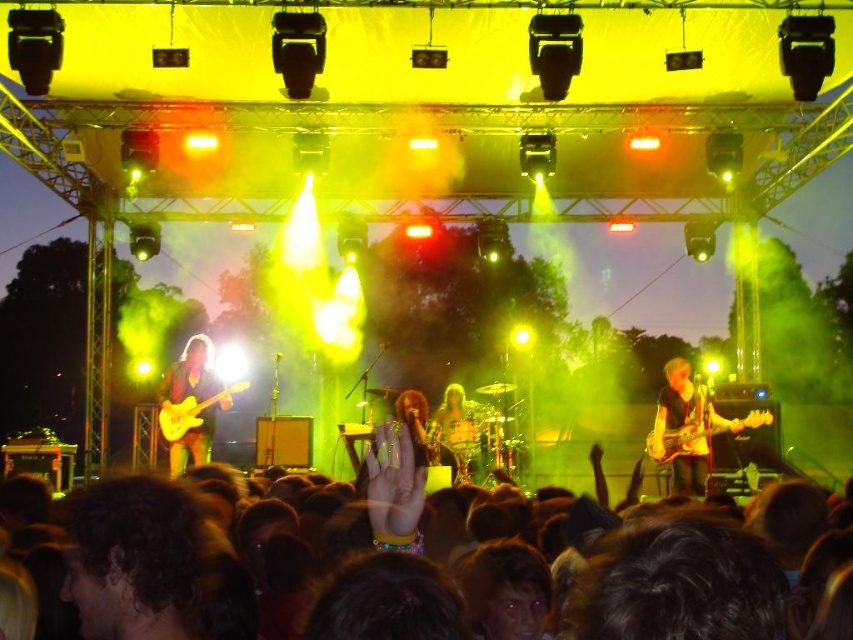
Question: Can you confirm if dark brown hair at lower center is wider than shiny gold guitar at left?

Choices:
 (A) no
 (B) yes

Answer: (A)

Question: Does matte black guitar at right appear under shiny gold guitar at left?

Choices:
 (A) no
 (B) yes

Answer: (B)

Question: Estimate the real-world distances between objects in this image. Which object is farther from the yellow matte electric guitar at left?

Choices:
 (A) glossy wood electric guitar at right
 (B) dark brown hair at lower center

Answer: (B)

Question: Can you confirm if shiny gold guitar at left is bigger than glossy wood electric guitar at right?

Choices:
 (A) yes
 (B) no

Answer: (A)

Question: Which point is closer to the camera?

Choices:
 (A) (654, 429)
 (B) (671, 387)
 (C) (218, 378)
 (D) (196, 419)

Answer: (A)

Question: Among these objects, which one is nearest to the camera?

Choices:
 (A) matte black guitar at right
 (B) glossy wood electric guitar at right

Answer: (B)